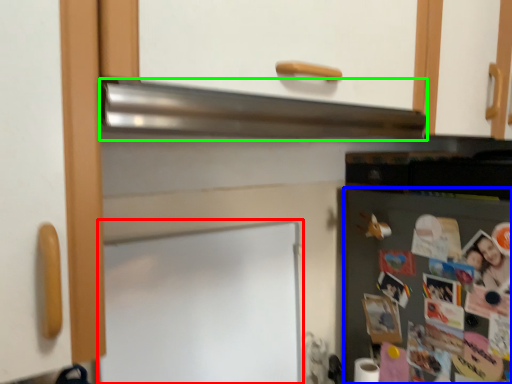
Question: Estimate the real-world distances between objects in this image. Which object is farther from bulletin board (highlighted by a red box), fridge (highlighted by a blue box) or exhaust hood (highlighted by a green box)?

Choices:
 (A) fridge
 (B) exhaust hood

Answer: (A)